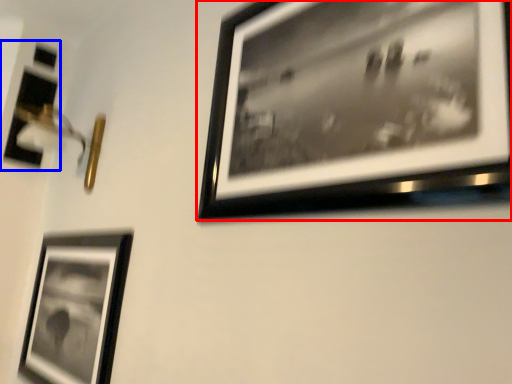
Question: Which object is further to the camera taking this photo, picture frame (highlighted by a red box) or picture frame (highlighted by a blue box)?

Choices:
 (A) picture frame
 (B) picture frame

Answer: (B)